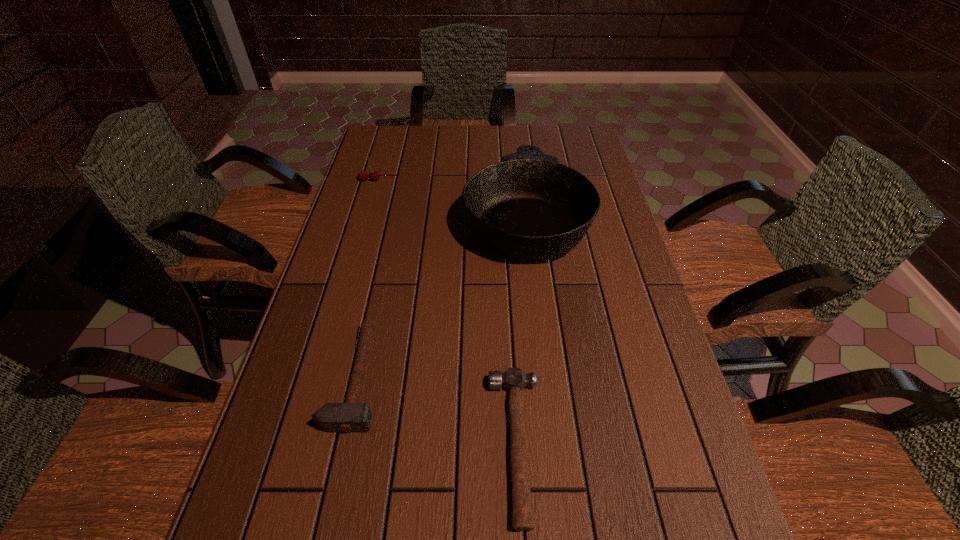
The width and height of the screenshot is (960, 540). What are the coordinates of `free region located on the surface of the leftmost object` in the screenshot? It's located at [345, 263].

This screenshot has height=540, width=960. In order to click on free location located 0.260m on the striking surface of the third tallest object in this screenshot , I will do `click(503, 377)`.

Find the location of a particular element. vacant space located on the striking face of the right hammer is located at coordinates (346, 444).

This screenshot has height=540, width=960. I want to click on vacant position located 0.170m on the striking face of the right hammer, so click(x=399, y=444).

Where is `vacant space located 0.320m on the striking face of the right hammer`? This screenshot has height=540, width=960. vacant space located 0.320m on the striking face of the right hammer is located at coordinates (319, 444).

What are the coordinates of `cherry that is at the left edge` in the screenshot? It's located at (363, 175).

The height and width of the screenshot is (540, 960). Identify the location of hammer located in the left edge section of the desktop. (350, 417).

This screenshot has width=960, height=540. What are the coordinates of `object at the right edge` in the screenshot? It's located at (529, 206).

Locate an element on the screen. The height and width of the screenshot is (540, 960). vacant space at the far edge of the desktop is located at coordinates (451, 154).

The height and width of the screenshot is (540, 960). I want to click on vacant space at the left edge of the desktop, so click(388, 234).